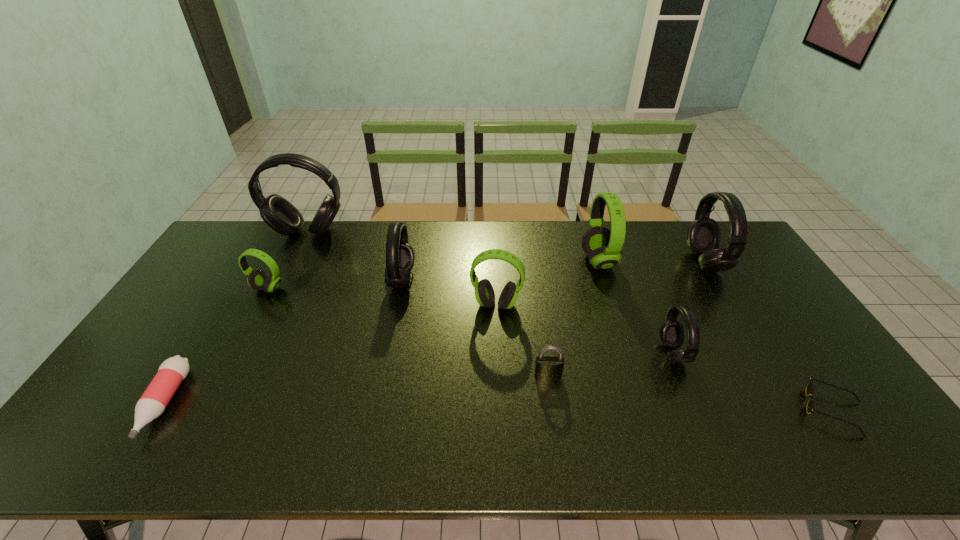
What are the coordinates of `vacant point located between the eighth object from left to right and the padlock` in the screenshot? It's located at (611, 364).

You are a GUI agent. You are given a task and a screenshot of the screen. Output one action in this format:
    pyautogui.click(x=<x>, y=<y>)
    Task: Click on the free area in between the eighth tallest object and the second smallest gray headset
    
    Given the screenshot: What is the action you would take?
    pyautogui.click(x=475, y=327)

Locate an element on the screen. The width and height of the screenshot is (960, 540). vacant space in between the nearest headset and the smallest green headset is located at coordinates (470, 321).

Find the location of `empty location between the third biggest gray headset and the sixth object from right to left`. empty location between the third biggest gray headset and the sixth object from right to left is located at coordinates (449, 292).

Where is `vacant space in between the fifth headset from left to right and the padlock`? Image resolution: width=960 pixels, height=540 pixels. vacant space in between the fifth headset from left to right and the padlock is located at coordinates (573, 318).

Where is `vacant area that lies between the second biggest green headset and the rightmost headset`? The height and width of the screenshot is (540, 960). vacant area that lies between the second biggest green headset and the rightmost headset is located at coordinates (600, 284).

This screenshot has width=960, height=540. I want to click on free point between the sunglasses and the biggest gray headset, so click(x=570, y=321).

The image size is (960, 540). In order to click on object that ranks as the second closest to the fifth headset from left to right in this screenshot , I will do `click(672, 333)`.

I want to click on object that ranks as the ninth closest to the pink bottle, so click(x=810, y=387).

Choose which headset is the nearest neighbor to the pink bottle. Please provide its 2D coordinates. Your answer should be formatted as a tuple, i.e. [(x, y)], where the tuple contains the x and y coordinates of a point satisfying the conditions above.

[(258, 280)]